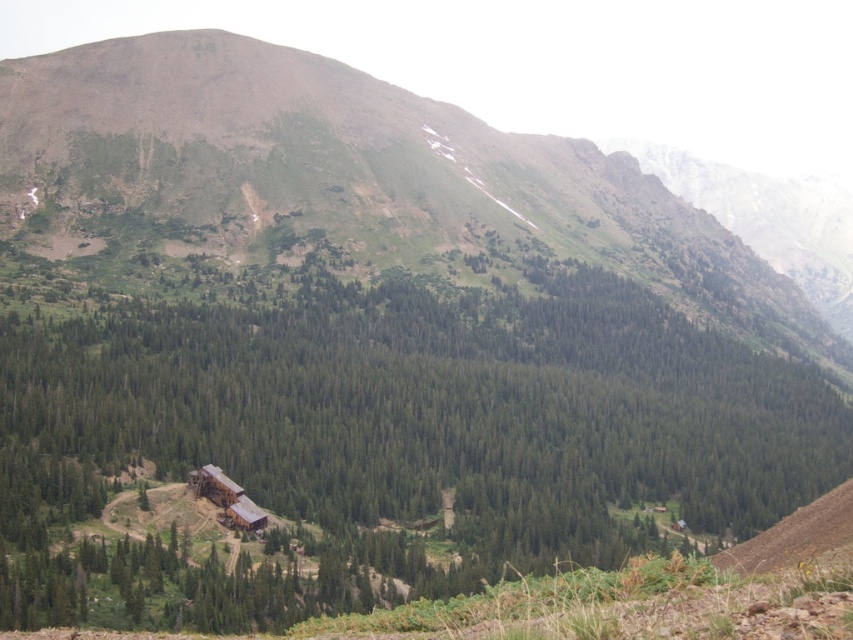
Question: Can you confirm if green wood cabin at center is positioned above green grassy mountain at upper center?

Choices:
 (A) yes
 (B) no

Answer: (B)

Question: Does green wood cabin at center appear over green grassy mountain at upper center?

Choices:
 (A) yes
 (B) no

Answer: (B)

Question: Which point is closer to the camera?

Choices:
 (A) green grassy mountain at upper center
 (B) green wood cabin at center

Answer: (B)

Question: Can you confirm if green wood cabin at center is positioned above green grassy mountain at upper center?

Choices:
 (A) no
 (B) yes

Answer: (A)